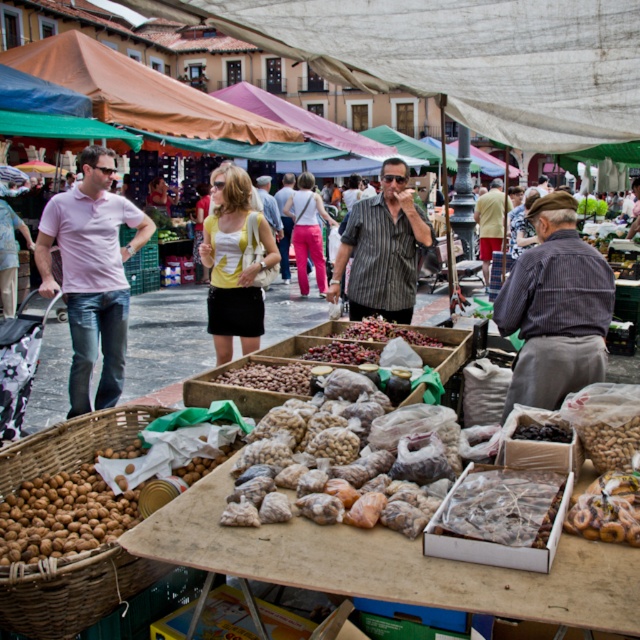
Question: Is pink cotton shirt at left smaller than brown matte nuts at lower left?

Choices:
 (A) yes
 (B) no

Answer: (B)

Question: Which of the following is the farthest from the observer?

Choices:
 (A) (86, 486)
 (B) (310, 401)

Answer: (B)

Question: Does brown woven basket at lower left appear on the left side of black matte olives at center?

Choices:
 (A) yes
 (B) no

Answer: (A)

Question: Does translucent plastic bags at center appear over brown woven basket at center?

Choices:
 (A) no
 (B) yes

Answer: (A)

Question: Which point appears closest to the camera in this image?

Choices:
 (A) (508, 531)
 (B) (140, 243)

Answer: (A)

Question: Which object is closer to the camera taking this photo?

Choices:
 (A) pink shirt at left
 (B) translucent plastic bags at center
 (C) pink cotton shirt at left

Answer: (B)